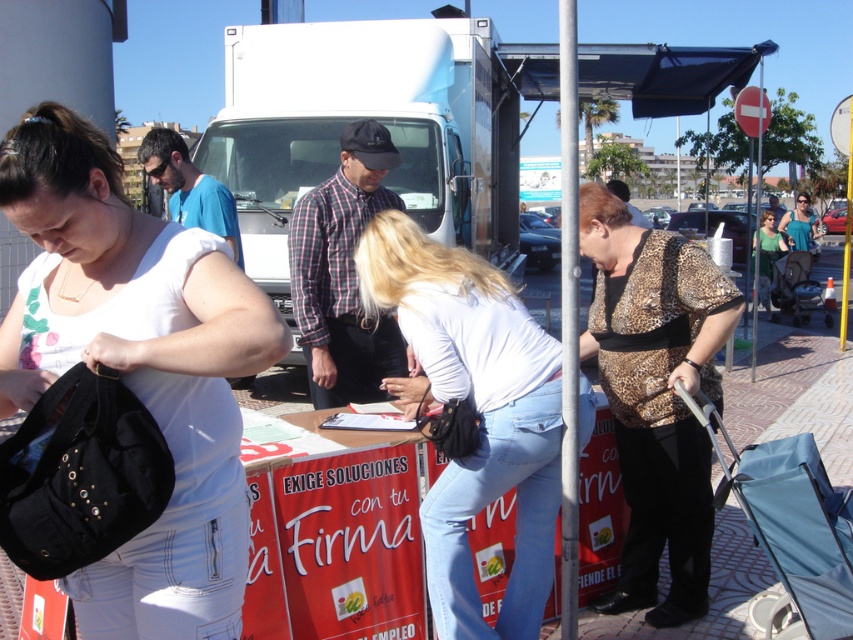
Measure the distance from matte black purse at center to plaid fabric shirt at center.

matte black purse at center and plaid fabric shirt at center are 99.28 centimeters apart from each other.

Between matte black purse at center and plaid fabric shirt at center, which one appears on the left side from the viewer's perspective?

plaid fabric shirt at center

Is point (409, 253) farther from camera compared to point (360, 392)?

No, (409, 253) is in front of (360, 392).

At what (x,y) coordinates should I click in order to perform the action: click on matte black purse at center. Please return your answer as a coordinate pair (x, y). Image resolution: width=853 pixels, height=640 pixels. Looking at the image, I should click on (477, 412).

Does black leather bag at left appear on the right side of plaid fabric shirt at center?

No, black leather bag at left is not to the right of plaid fabric shirt at center.

Where is `black leather bag at left`? The image size is (853, 640). black leather bag at left is located at coordinates (137, 365).

Does white glossy food truck at center appear over green jersey at center?

Incorrect, white glossy food truck at center is not positioned above green jersey at center.

Is white glossy food truck at center taller than green jersey at center?

No.

Which is behind, point (241, 177) or point (769, 307)?

The point (769, 307) is more distant.

I want to click on white glossy food truck at center, so click(x=361, y=116).